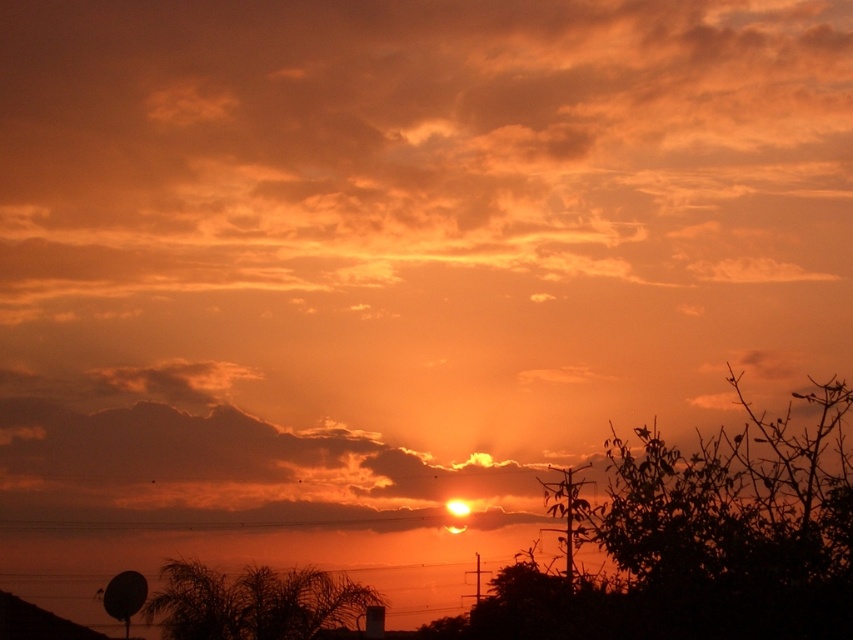
Can you confirm if silhouette leafy tree at lower right is smaller than silhouette leafy tree at lower left?

Actually, silhouette leafy tree at lower right might be larger than silhouette leafy tree at lower left.

Between point (616, 564) and point (282, 627), which one is positioned behind?

Positioned behind is point (282, 627).

Is point (764, 465) more distant than point (190, 636)?

That is False.

At what (x,y) coordinates should I click in order to perform the action: click on silhouette leafy tree at lower right. Please return your answer as a coordinate pair (x, y). Looking at the image, I should click on (730, 529).